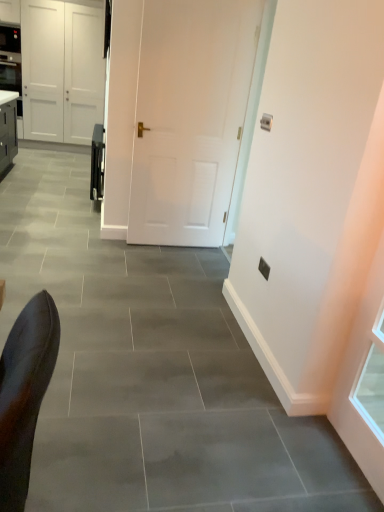
Question: Would you say white matte door at center, placed as the second door when sorted from back to front, is to the left or to the right of white matte door at center, positioned as the 2th door in right-to-left order, in the picture?

Choices:
 (A) left
 (B) right

Answer: (B)

Question: From a real-world perspective, is white matte door at center, the 2th door in the left-to-right sequence, positioned above or below white matte door at center, positioned as the 2th door in right-to-left order?

Choices:
 (A) above
 (B) below

Answer: (B)

Question: Which object is the farthest from the satin black oven at center?

Choices:
 (A) white matte door at center, positioned as the 2th door in right-to-left order
 (B) white matte door at center, positioned as the 1th door in right-to-left order

Answer: (A)

Question: Which object is the farthest from the white matte door at center, positioned as the 1th door in right-to-left order?

Choices:
 (A) white matte door at center, which ranks as the first door in top-to-bottom order
 (B) satin black oven at center

Answer: (A)